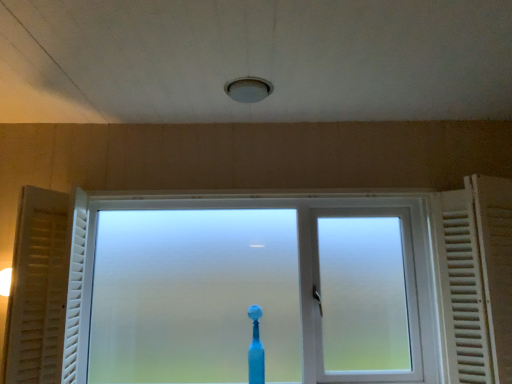
Question: From their relative heights in the image, would you say frosted glass window at center is taller or shorter than blue plastic toothbrush at center?

Choices:
 (A) short
 (B) tall

Answer: (B)

Question: From a real-world perspective, relative to blue plastic toothbrush at center, is frosted glass window at center vertically above or below?

Choices:
 (A) below
 (B) above

Answer: (B)

Question: Estimate the real-world distances between objects in this image. Which object is closer to the frosted glass window at center?

Choices:
 (A) white matte curtain at left
 (B) white wooden radiator at right
 (C) blue plastic toothbrush at center

Answer: (B)

Question: Based on their relative distances, which object is nearer to the blue plastic toothbrush at center?

Choices:
 (A) frosted glass window at center
 (B) white matte curtain at left
 (C) white wooden radiator at right

Answer: (A)